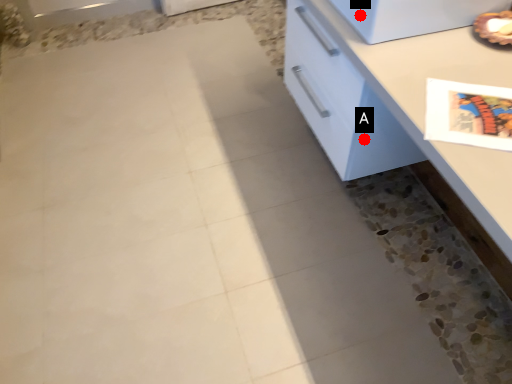
Question: Two points are circled on the image, labeled by A and B beside each circle. Which point is closer to the camera?

Choices:
 (A) A is closer
 (B) B is closer

Answer: (B)